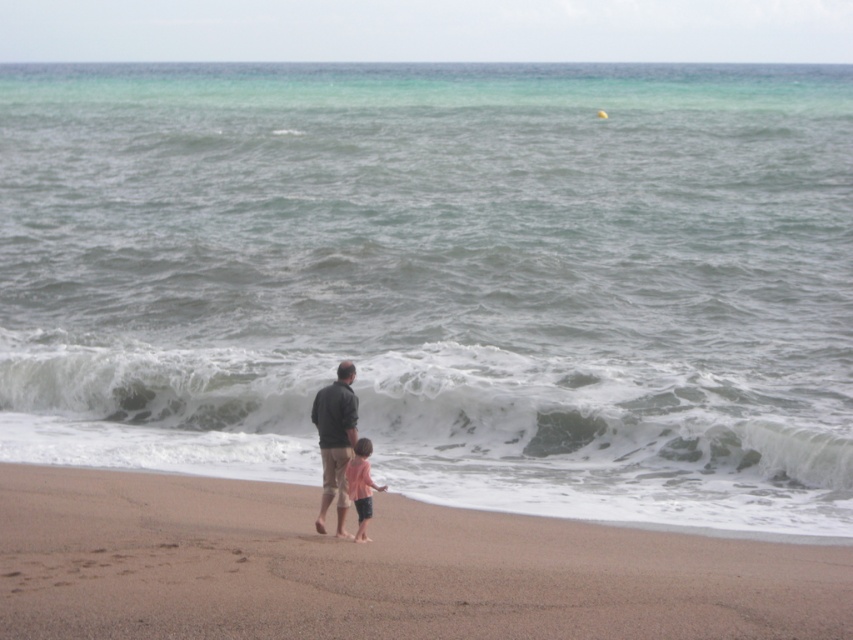
Question: Estimate the real-world distances between objects in this image. Which object is farther from the brown sandy beach at lower center?

Choices:
 (A) pink fabric shirt at lower center
 (B) dark gray jacket at center

Answer: (B)

Question: In this image, where is brown sandy beach at lower center located relative to pink fabric shirt at lower center?

Choices:
 (A) right
 (B) left

Answer: (A)

Question: Which point is farther from the camera taking this photo?

Choices:
 (A) (354, 490)
 (B) (339, 452)

Answer: (B)

Question: Can you confirm if brown sandy beach at lower center is wider than pink fabric shirt at lower center?

Choices:
 (A) no
 (B) yes

Answer: (B)

Question: Estimate the real-world distances between objects in this image. Which object is closer to the pink fabric shirt at lower center?

Choices:
 (A) brown sandy beach at lower center
 (B) dark gray jacket at center

Answer: (B)

Question: Is brown sandy beach at lower center to the right of pink fabric shirt at lower center from the viewer's perspective?

Choices:
 (A) yes
 (B) no

Answer: (A)